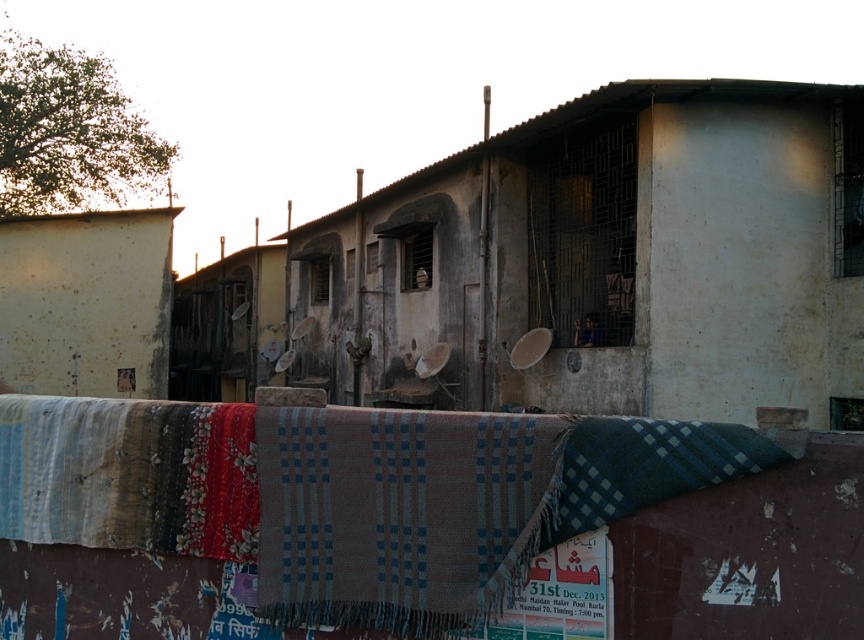
Can you confirm if multicolored woven cloth at center is wider than yellowish concrete hut at center?

No, multicolored woven cloth at center is not wider than yellowish concrete hut at center.

Based on the photo, can you confirm if multicolored woven cloth at center is positioned to the left of yellowish concrete hut at center?

Incorrect, multicolored woven cloth at center is not on the left side of yellowish concrete hut at center.

Which is in front, point (153, 412) or point (213, 292)?

Positioned in front is point (153, 412).

You are a GUI agent. You are given a task and a screenshot of the screen. Output one action in this format:
    pyautogui.click(x=<x>, y=<y>)
    Task: Click on the multicolored woven cloth at center
    
    Given the screenshot: What is the action you would take?
    coord(348,493)

Between multicolored woven cloth at center and plaid woolen blanket at center, which one appears on the left side from the viewer's perspective?

Positioned to the left is multicolored woven cloth at center.

Is multicolored woven cloth at center positioned at the back of plaid woolen blanket at center?

No, it is not.

Locate an element on the screen. The image size is (864, 640). multicolored woven cloth at center is located at coordinates (348, 493).

Between weathered concrete building at center and plaid woolen blanket at center, which one appears on the left side from the viewer's perspective?

plaid woolen blanket at center

Who is shorter, weathered concrete building at center or plaid woolen blanket at center?

Standing shorter between the two is plaid woolen blanket at center.

In the scene shown: Who is more forward, [573,180] or [526,465]?

Point [526,465] is more forward.

Image resolution: width=864 pixels, height=640 pixels. Identify the location of weathered concrete building at center. (610, 259).